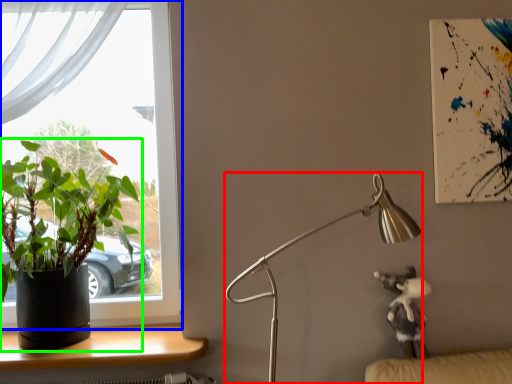
Question: Based on their relative distances, which object is farther from lamp (highlighted by a red box)? Choose from window (highlighted by a blue box) and houseplant (highlighted by a green box).

Choices:
 (A) window
 (B) houseplant

Answer: (A)